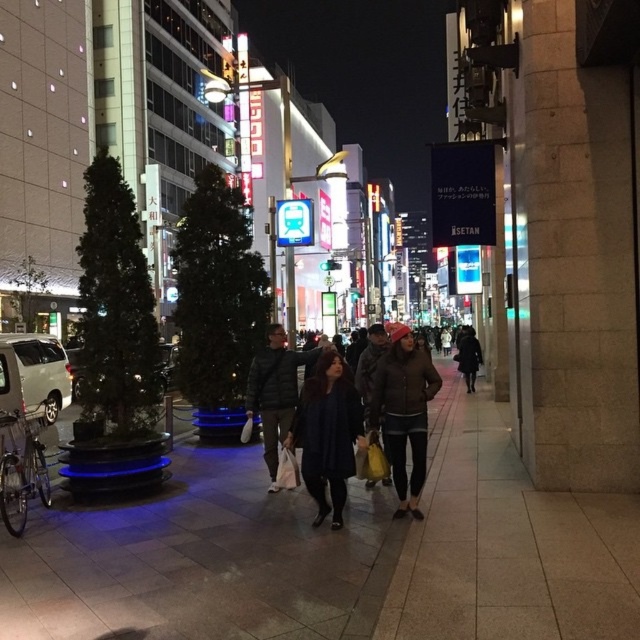
You are a photographer trying to capture both the matte brown jacket at center and the dark green puffer jacket at center in a single shot. Which jacket will appear larger in the photo?

The matte brown jacket at center will appear larger in the photo because it is closer to the viewer than the dark green puffer jacket at center.

You are a photographer standing on the walkway in the urban street scene. You see the dark green puffer jacket at center and the dark gray coat at center. Which one is higher in the image?

The dark green puffer jacket at center is above the dark gray coat at center, so it is higher in the image.

You are a photographer standing on the walkway in the urban street scene. You want to take a photo of both the dark green puffer jacket at center and the dark gray coat at center. Which one should you focus on first if you want to capture them in order from left to right?

The dark green puffer jacket at center should be focused on first because it is positioned on the left side of the dark gray coat at center.